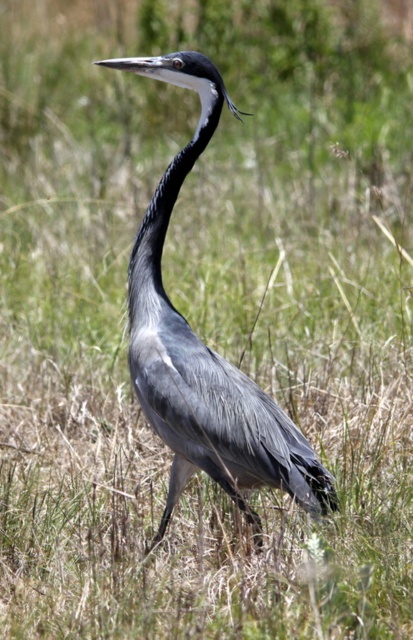
Between gray feathered heron at center and smooth grey neck at center, which one has more height?

gray feathered heron at center

Which is more to the right, gray feathered heron at center or smooth grey neck at center?

Positioned to the right is gray feathered heron at center.

Between point (241, 474) and point (140, 273), which one is positioned in front?

Point (241, 474) is more forward.

The width and height of the screenshot is (413, 640). I want to click on gray feathered heron at center, so click(204, 348).